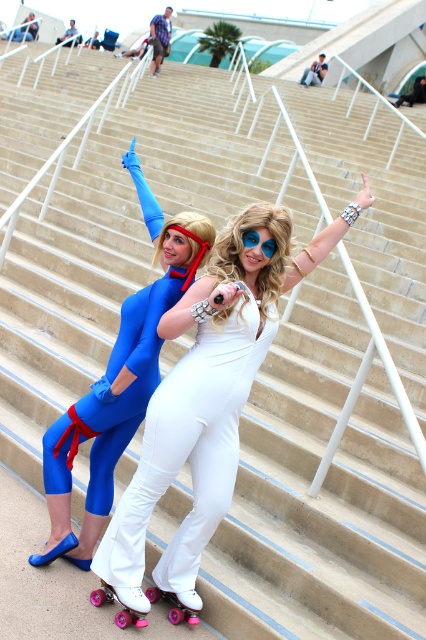
Question: Is white satin jumpsuit at center wider than metallic silver car at upper right?

Choices:
 (A) yes
 (B) no

Answer: (A)

Question: Does white satin jumpsuit at center have a larger size compared to matte blue jumpsuit at center?

Choices:
 (A) no
 (B) yes

Answer: (A)

Question: Estimate the real-world distances between objects in this image. Which object is closer to the white satin jumpsuit at center?

Choices:
 (A) matte blue jumpsuit at left
 (B) brushed metal water at bottle left
 (C) blue spandex suit at upper left

Answer: (A)

Question: Which object appears closest to the camera in this image?

Choices:
 (A) matte blue jumpsuit at left
 (B) metallic silver car at upper right

Answer: (A)

Question: Is matte blue jumpsuit at center positioned in front of blue spandex suit at upper left?

Choices:
 (A) yes
 (B) no

Answer: (A)

Question: Which object is farther from the camera taking this photo?

Choices:
 (A) brushed metal water at bottle left
 (B) metallic silver car at upper right
 (C) matte blue jumpsuit at center
 (D) matte blue jumpsuit at left

Answer: (B)